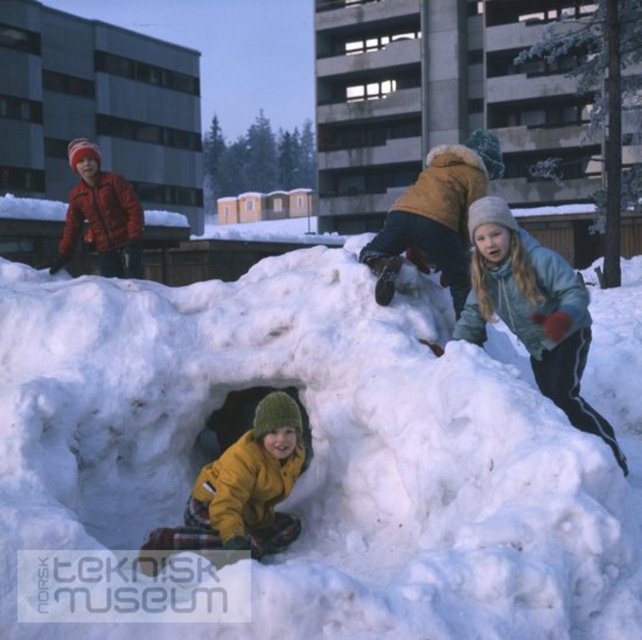
Does white fluffy snow at center have a smaller size compared to blue fleece jacket at upper right?

Indeed, white fluffy snow at center has a smaller size compared to blue fleece jacket at upper right.

Image resolution: width=642 pixels, height=640 pixels. Describe the element at coordinates (327, 451) in the screenshot. I see `white fluffy snow at center` at that location.

Who is more forward, (3, 536) or (465, 312)?

Point (3, 536) is more forward.

Find the location of a particular element. The height and width of the screenshot is (640, 642). white fluffy snow at center is located at coordinates point(327,451).

Can you confirm if white fluffy snow at center is positioned to the left of yellow fleece jacket at center?

No, white fluffy snow at center is not to the left of yellow fleece jacket at center.

Who is more forward, (584,584) or (254,458)?

Point (584,584) is in front.

Between point (639, 540) and point (254, 552), which one is positioned in front?

Point (639, 540) is in front.

The height and width of the screenshot is (640, 642). Identify the location of white fluffy snow at center. (327, 451).

Which of these two, blue fleece jacket at upper right or yellow fleece jacket at center, stands shorter?

Standing shorter between the two is yellow fleece jacket at center.

Is point (517, 285) less distant than point (177, 545)?

No.

Where is `blue fleece jacket at upper right`? blue fleece jacket at upper right is located at coordinates (532, 308).